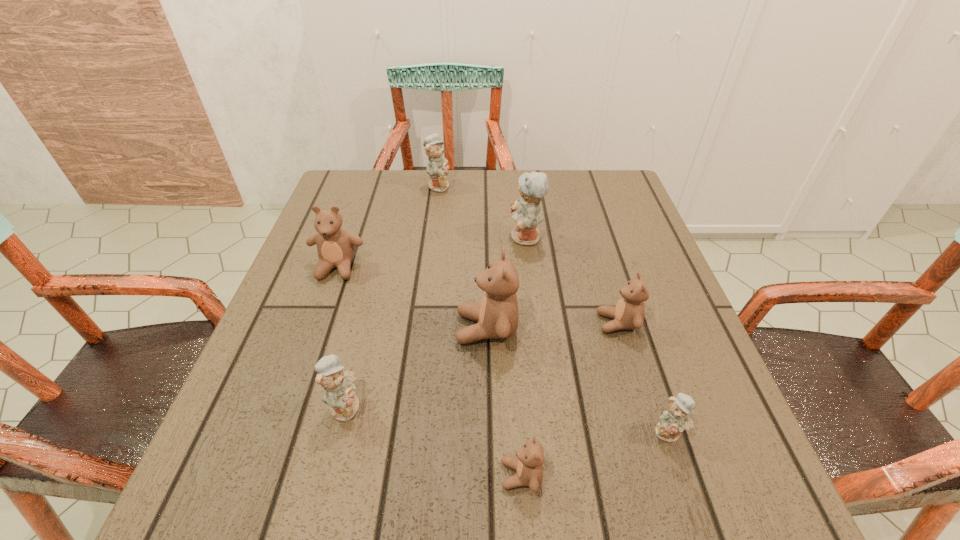
You are a GUI agent. You are given a task and a screenshot of the screen. Output one action in this format:
    pyautogui.click(x=<x>, y=<y>)
    Task: Click on the object that is at the near edge
    
    Given the screenshot: What is the action you would take?
    pyautogui.click(x=528, y=464)

You are a GUI agent. You are given a task and a screenshot of the screen. Output one action in this format:
    pyautogui.click(x=<x>, y=<y>)
    Task: Click on the free space at the far edge
    The width and height of the screenshot is (960, 540).
    Given the screenshot: What is the action you would take?
    pyautogui.click(x=396, y=205)

You are a GUI agent. You are given a task and a screenshot of the screen. Output one action in this format:
    pyautogui.click(x=<x>, y=<y>)
    Task: Click on the free point at the near edge
    
    Given the screenshot: What is the action you would take?
    pyautogui.click(x=630, y=478)

This screenshot has height=540, width=960. I want to click on vacant area at the left edge, so click(260, 403).

Find the location of a particular element. This screenshot has height=540, width=960. vacant space at the right edge is located at coordinates (723, 414).

Where is `free point at the far left corner`? This screenshot has height=540, width=960. free point at the far left corner is located at coordinates (339, 199).

Where is `free location at the far right corner`? The height and width of the screenshot is (540, 960). free location at the far right corner is located at coordinates (618, 206).

The image size is (960, 540). In the image, there is a desktop. In order to click on vacant area at the near right corner in this screenshot , I will do `click(735, 491)`.

Locate an element on the screen. Image resolution: width=960 pixels, height=540 pixels. free space between the nearest brown teddy bear and the rightmost brown teddy bear is located at coordinates (569, 399).

Image resolution: width=960 pixels, height=540 pixels. What are the coordinates of `empty space between the farthest brown teddy bear and the biggest brown teddy bear` in the screenshot? It's located at (412, 298).